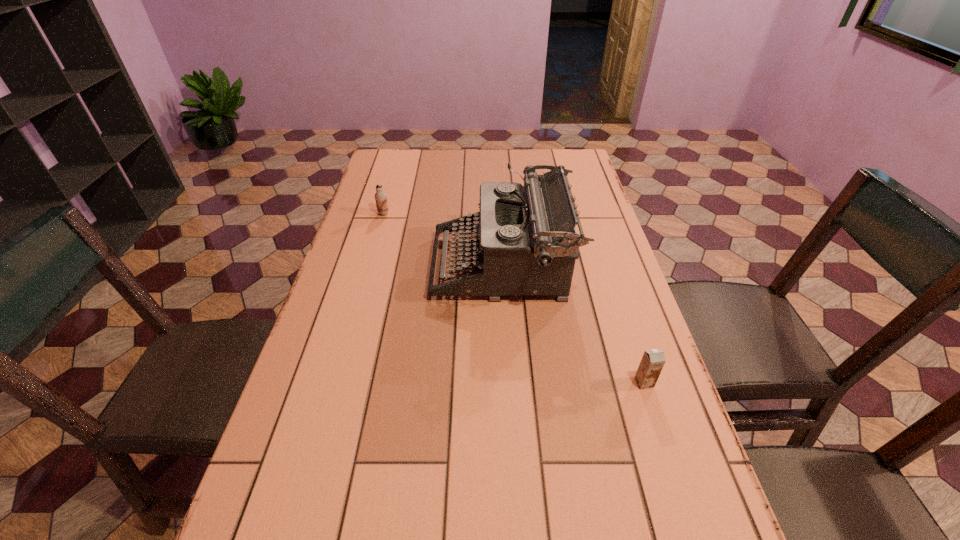
You are a GUI agent. You are given a task and a screenshot of the screen. Output one action in this format:
    pyautogui.click(x=<x>, y=<y>)
    Task: Click on the free space that satisfies the following two spatial constraints: 1. on the front side of the leftmost object; 2. on the right side of the right chocolate milk
    Image resolution: width=960 pixels, height=540 pixels.
    Given the screenshot: What is the action you would take?
    pyautogui.click(x=335, y=383)

The image size is (960, 540). I want to click on vacant space that satisfies the following two spatial constraints: 1. on the typing side of the right chocolate milk; 2. on the left side of the second object from right to left, so click(x=509, y=383).

Identify the location of free location that satisfies the following two spatial constraints: 1. on the front side of the left chocolate milk; 2. on the right side of the right chocolate milk. point(335,383).